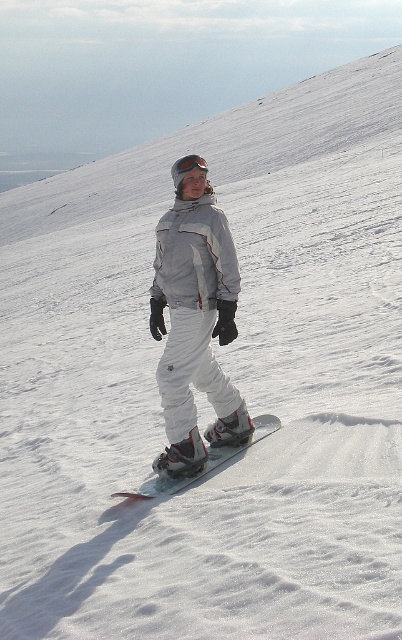
Is white matte snowboarder at center bigger than white plastic snowboard at center?

Indeed, white matte snowboarder at center has a larger size compared to white plastic snowboard at center.

Does white matte snowboarder at center have a smaller size compared to white plastic snowboard at center?

No, white matte snowboarder at center is not smaller than white plastic snowboard at center.

Is point (176, 480) positioned in front of point (131, 496)?

No, it is behind (131, 496).

Where is `white matte snowboarder at center`? This screenshot has width=402, height=640. white matte snowboarder at center is located at coordinates (196, 336).

Is white matte snowboarder at center positioned in front of matte black goggles at center?

Yes, white matte snowboarder at center is closer to the viewer.

Which is more to the right, white matte snowboarder at center or matte black goggles at center?

white matte snowboarder at center

At what (x,y) coordinates should I click in order to perform the action: click on white matte snowboarder at center. Please return your answer as a coordinate pair (x, y). This screenshot has height=640, width=402. Looking at the image, I should click on (196, 336).

Is point (260, 428) closer to viewer compared to point (184, 156)?

Yes, point (260, 428) is in front of point (184, 156).

You are a GUI agent. You are given a task and a screenshot of the screen. Output one action in this format:
    pyautogui.click(x=<x>, y=<y>)
    Task: Click on the white plastic snowboard at center
    
    Given the screenshot: What is the action you would take?
    pyautogui.click(x=203, y=464)